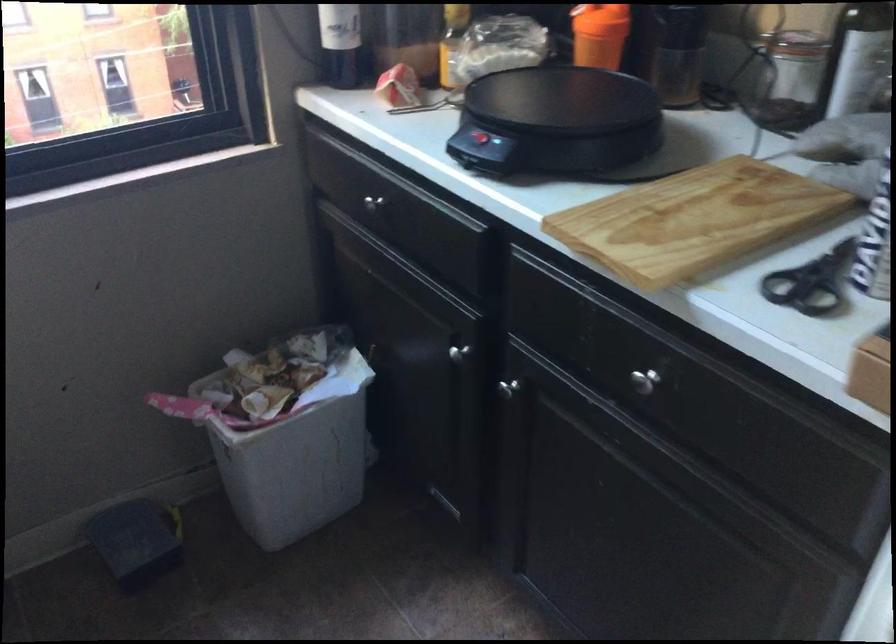
The width and height of the screenshot is (896, 644). Identify the location of orange shaker bottle. (599, 35).